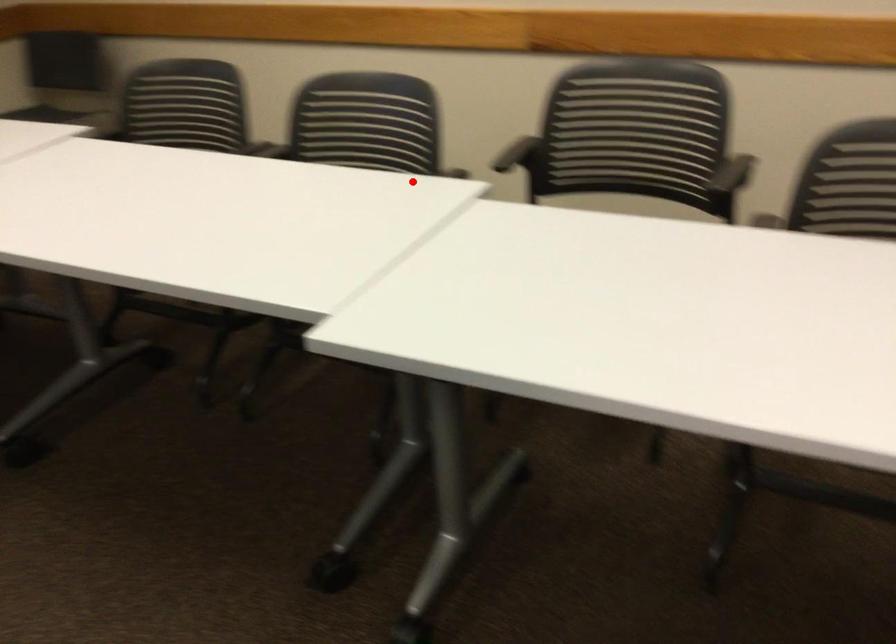
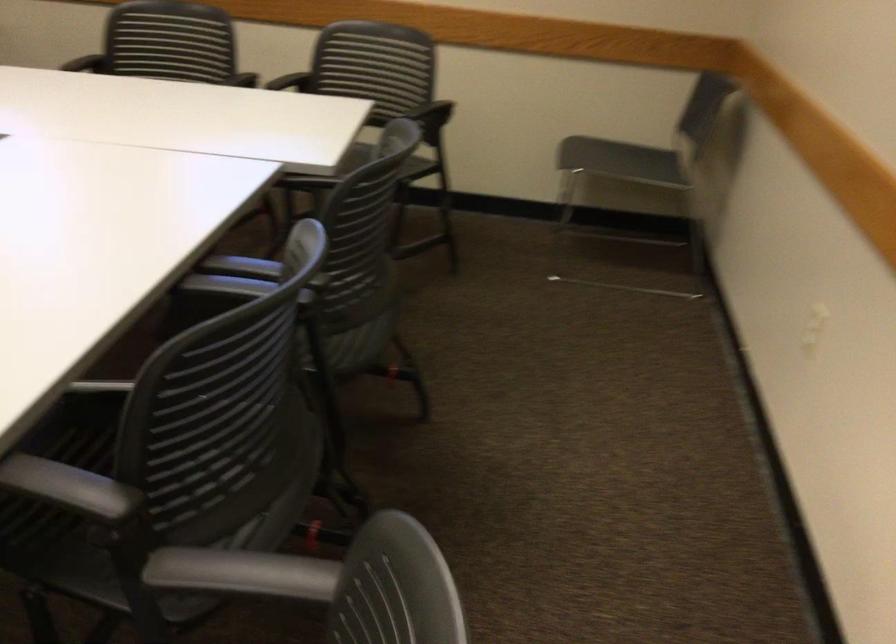
Find the pixel in the second image that matches the highlighted location in the first image.

(209, 458)